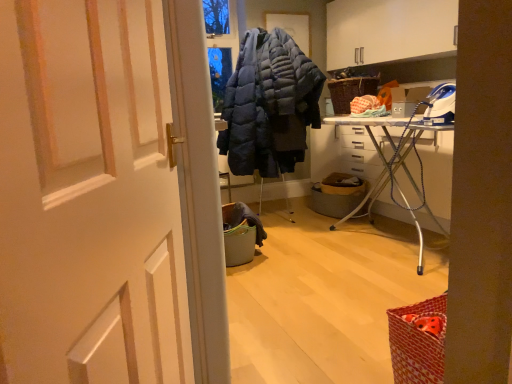
Find the location of `vacant space to the left of metallic gray laundry basket at center`. vacant space to the left of metallic gray laundry basket at center is located at coordinates (288, 212).